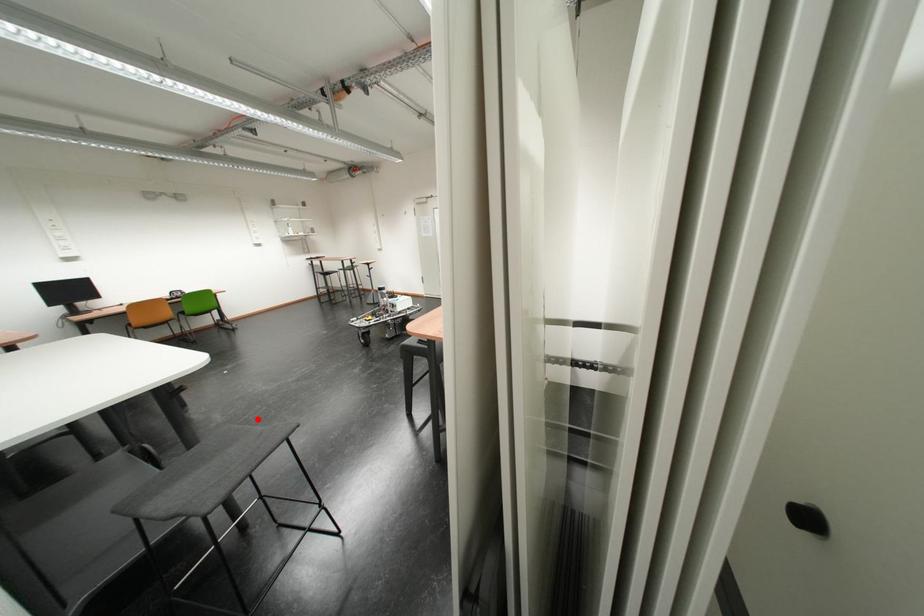
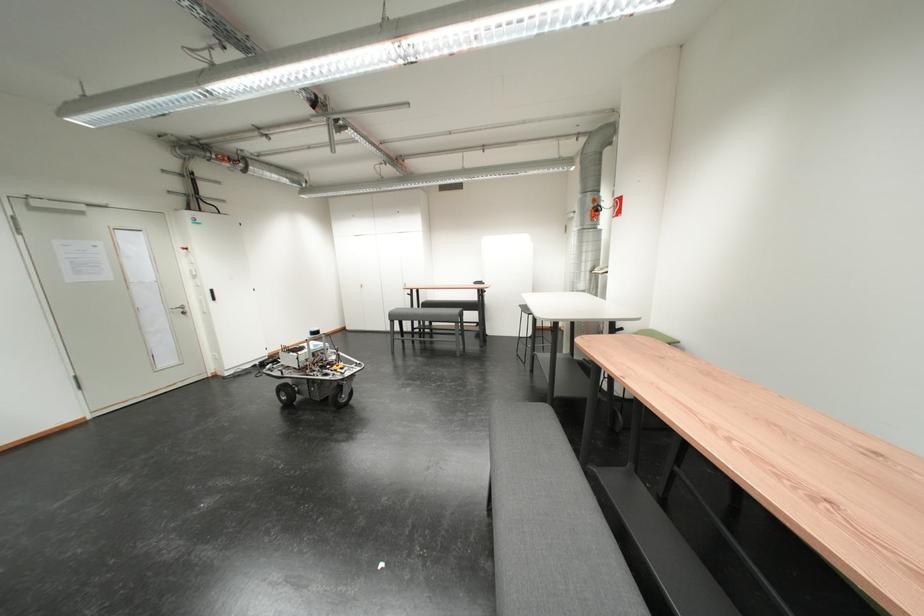
Question: A red point is marked in image1. In image2, is the corresponding 3D point closer to the camera or farther? Reply with the corresponding letter.

Choices:
 (A) The corresponding 3D point is closer.
 (B) The corresponding 3D point is farther.

Answer: (A)